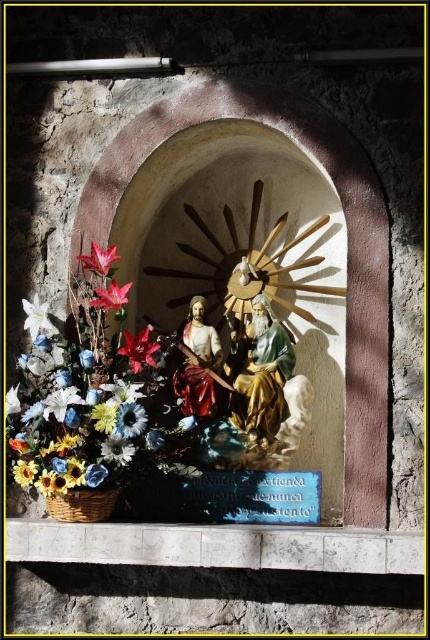
Question: Which object is the closest to the pink matte flower at center?

Choices:
 (A) matte red flower at center
 (B) yellow matte flower at center
 (C) yellow matte sunflower at lower left

Answer: (A)

Question: Does white matte flower at lower left come behind yellow matte sunflower at lower left?

Choices:
 (A) no
 (B) yes

Answer: (B)

Question: Does polychrome wood statue of jesus at center have a smaller size compared to sunflowersmoothflower at lower left?

Choices:
 (A) yes
 (B) no

Answer: (B)

Question: Which of the following is the farthest from the observer?

Choices:
 (A) white matte flower at lower left
 (B) yellow matte flower at center
 (C) yellow matte sunflower at lower left

Answer: (B)

Question: Which point appears closest to the camera in this image?

Choices:
 (A) (46, 403)
 (B) (125, 422)
 (C) (24, 464)

Answer: (B)

Question: Can you confirm if matte red flower at center is wider than matte sunflower at lower left?

Choices:
 (A) no
 (B) yes

Answer: (B)